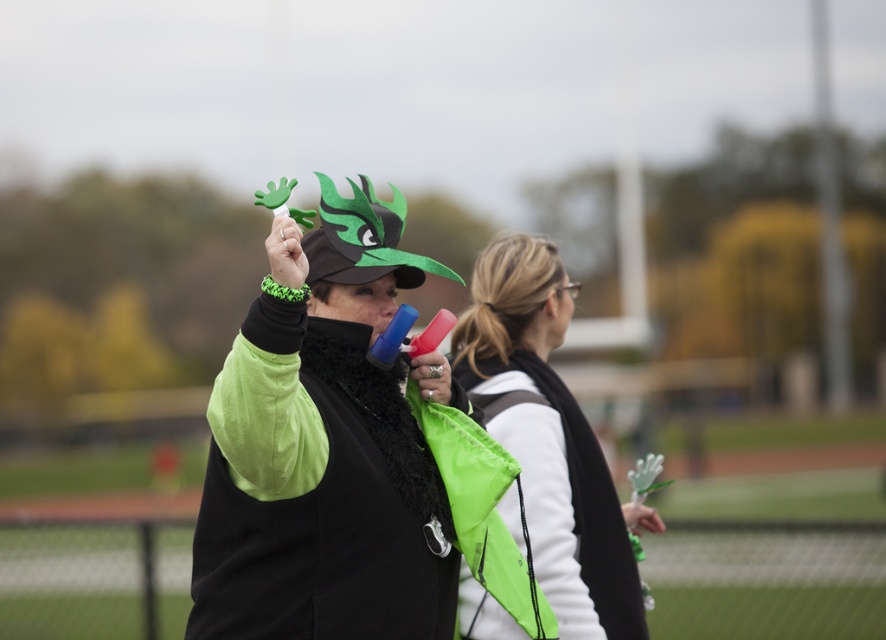
Question: Does matte green plastic hand at center have a lesser width compared to neon green jacket at center?

Choices:
 (A) yes
 (B) no

Answer: (B)

Question: Which object appears farthest from the camera in this image?

Choices:
 (A) neon green jacket at center
 (B) matte green plastic hand at center

Answer: (A)

Question: Is matte green plastic hand at center to the left of neon green jacket at center from the viewer's perspective?

Choices:
 (A) yes
 (B) no

Answer: (A)

Question: Which of the following is the farthest from the observer?

Choices:
 (A) matte green plastic hand at center
 (B) neon green jacket at center

Answer: (B)

Question: Is matte green plastic hand at center above neon green jacket at center?

Choices:
 (A) no
 (B) yes

Answer: (B)